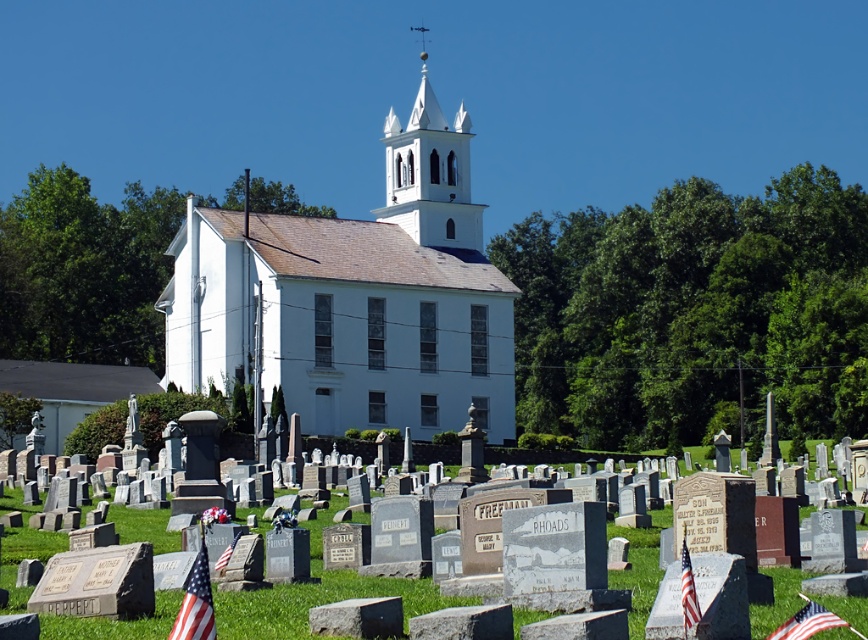
You are standing at the entrance of the cemetery and see the white stucco spire at upper center and the american flag at lower left. Which object is positioned to the right of the other?

The white stucco spire at upper center is to the right of the american flag at lower left.

You are standing in the cemetery and want to take a photo of both the point at (352, 579) and the point at (788, 632). Which point is closer to your camera lens?

The point at (352, 579) is closer to the camera lens than the point at (788, 632).